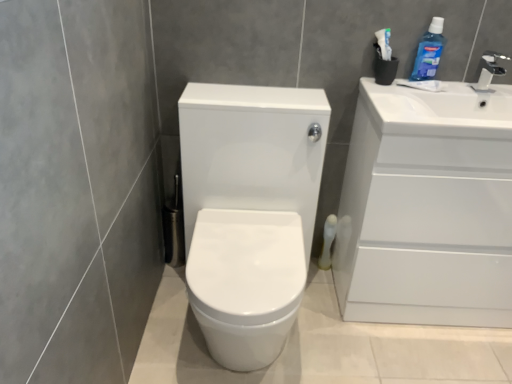
Question: Considering the relative sizes of white glossy cabinet at right and white glossy faucet at upper right in the image provided, is white glossy cabinet at right wider than white glossy faucet at upper right?

Choices:
 (A) yes
 (B) no

Answer: (A)

Question: From the image's perspective, would you say white glossy cabinet at right is shown under white glossy faucet at upper right?

Choices:
 (A) yes
 (B) no

Answer: (A)

Question: Is white glossy cabinet at right aimed at white glossy faucet at upper right?

Choices:
 (A) no
 (B) yes

Answer: (A)

Question: From a real-world perspective, is white glossy cabinet at right under white glossy faucet at upper right?

Choices:
 (A) no
 (B) yes

Answer: (B)

Question: Is white glossy cabinet at right looking in the opposite direction of white glossy faucet at upper right?

Choices:
 (A) yes
 (B) no

Answer: (B)

Question: Considering the positions of white glossy cabinet at right and white glossy faucet at upper right in the image, is white glossy cabinet at right wider or thinner than white glossy faucet at upper right?

Choices:
 (A) wide
 (B) thin

Answer: (A)

Question: Looking at the image, does white glossy cabinet at right seem bigger or smaller compared to white glossy faucet at upper right?

Choices:
 (A) big
 (B) small

Answer: (A)

Question: Which is correct: white glossy cabinet at right is inside white glossy faucet at upper right, or outside of it?

Choices:
 (A) outside
 (B) inside

Answer: (A)

Question: From the image's perspective, is white glossy cabinet at right above or below white glossy faucet at upper right?

Choices:
 (A) above
 (B) below

Answer: (B)

Question: From a real-world perspective, relative to white glossy toilet at center, is white matte toilet paper at lower right vertically above or below?

Choices:
 (A) below
 (B) above

Answer: (A)

Question: From their relative heights in the image, would you say white matte toilet paper at lower right is taller or shorter than white glossy toilet at center?

Choices:
 (A) short
 (B) tall

Answer: (A)

Question: From the image's perspective, is white matte toilet paper at lower right located above or below white glossy toilet at center?

Choices:
 (A) above
 (B) below

Answer: (B)

Question: Do you think white matte toilet paper at lower right is within white glossy toilet at center, or outside of it?

Choices:
 (A) inside
 (B) outside

Answer: (B)

Question: Is white matte toilet paper at lower right bigger or smaller than blue glossy mouthwash at upper right?

Choices:
 (A) small
 (B) big

Answer: (A)

Question: Relative to blue glossy mouthwash at upper right, is white matte toilet paper at lower right in front or behind?

Choices:
 (A) behind
 (B) front

Answer: (A)